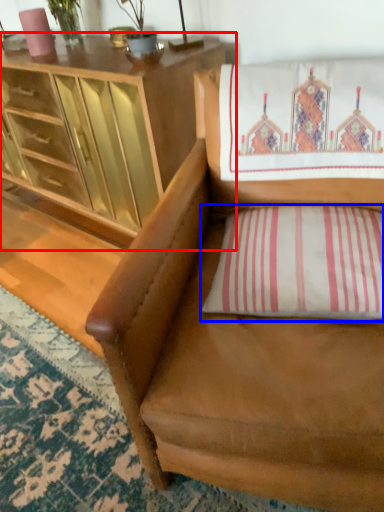
Question: Which object is further to the camera taking this photo, cabinetry (highlighted by a red box) or pillow (highlighted by a blue box)?

Choices:
 (A) cabinetry
 (B) pillow

Answer: (A)